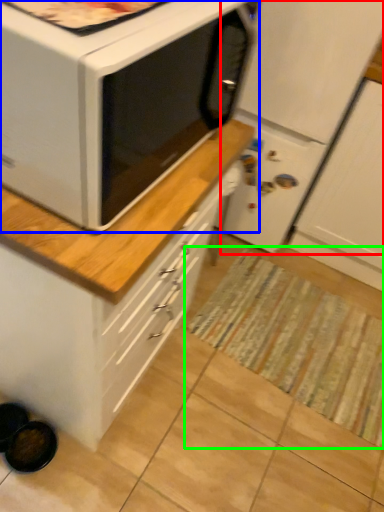
Question: Which is farther away from refrigerator (highlighted by a red box)? microwave oven (highlighted by a blue box) or mat (highlighted by a green box)?

Choices:
 (A) microwave oven
 (B) mat

Answer: (B)